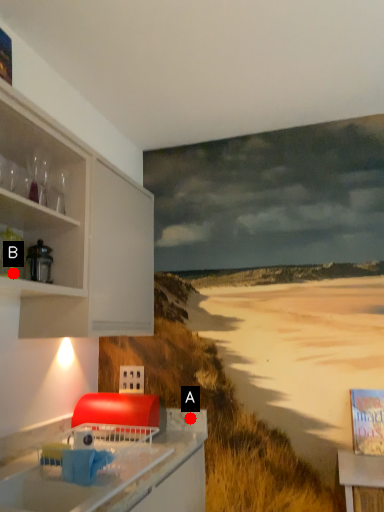
Question: Two points are circled on the image, labeled by A and B beside each circle. Which point is closer to the camera taking this photo?

Choices:
 (A) A is closer
 (B) B is closer

Answer: (B)